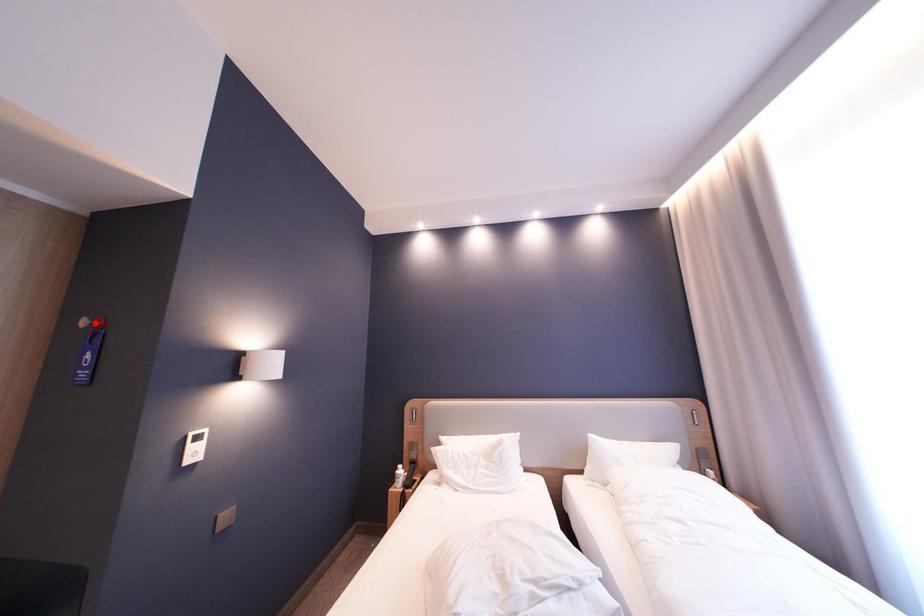
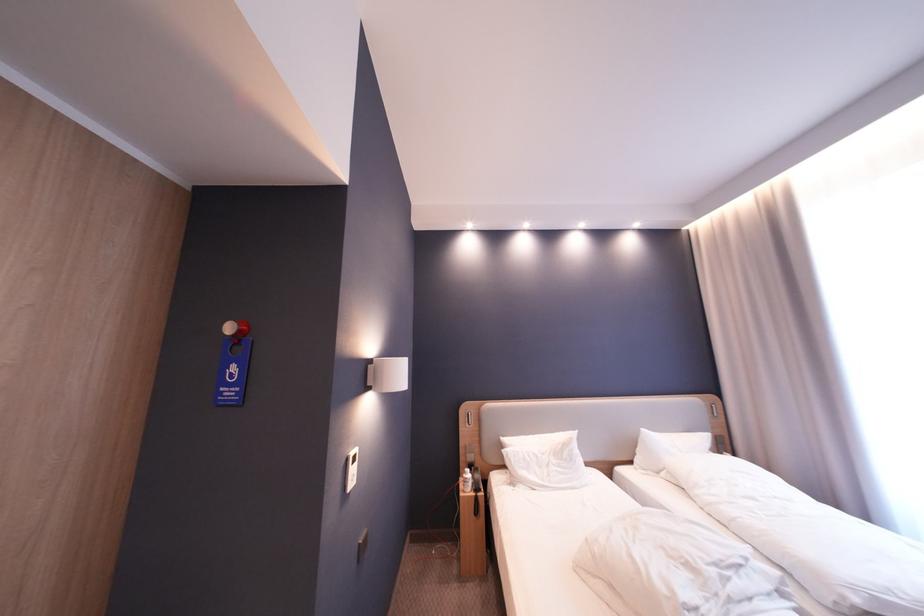
Find the pixel in the second image that matches the highlighted location in the first image.

(240, 329)